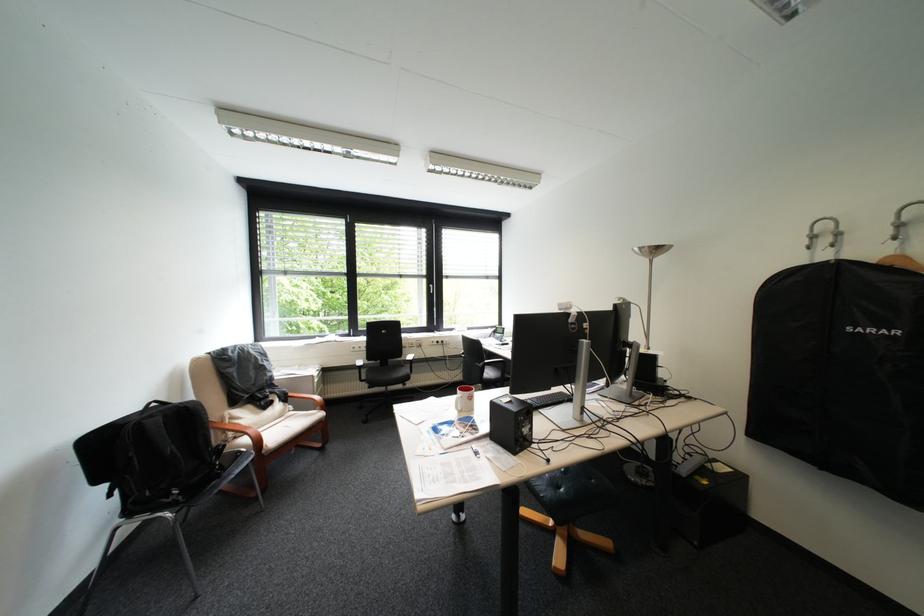
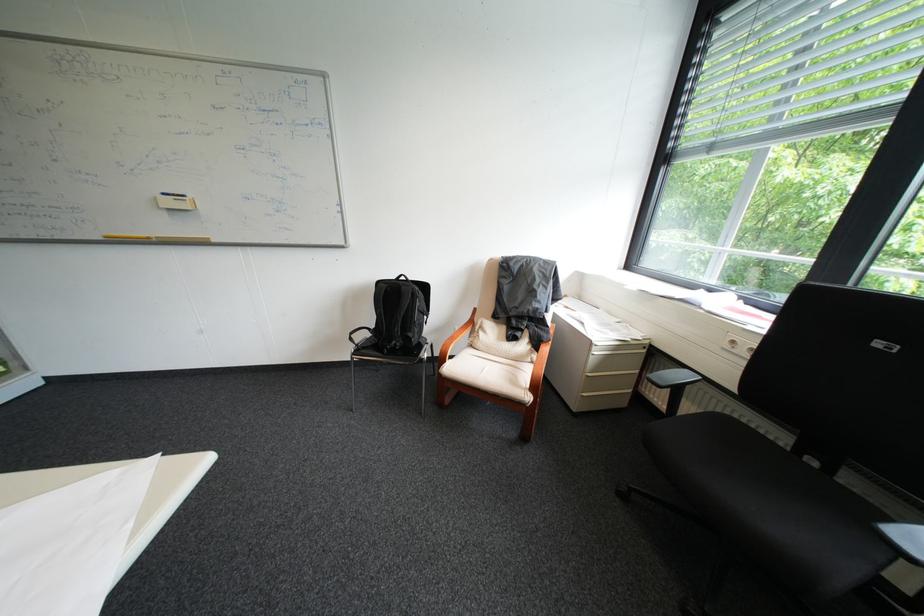
Find the pixel in the second image that matches point 329,381 in the first image.

(609, 353)